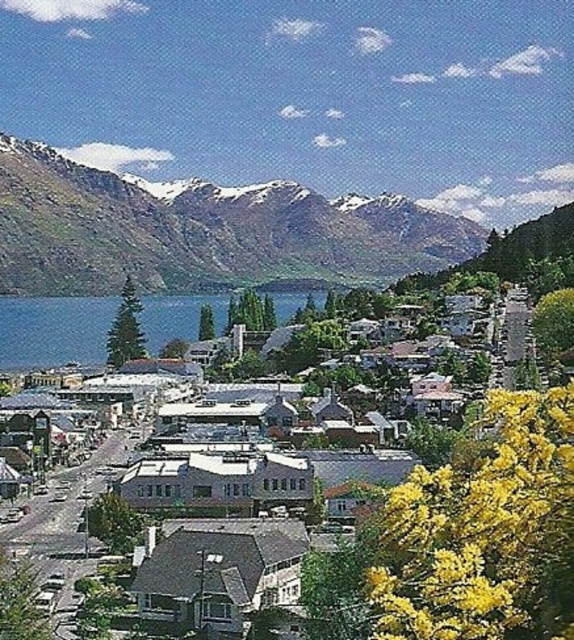
You are standing at the center of the town and want to reach the blue water at center. According to the map, there is a point marked at coordinates point [53,330]. Can you determine if this point is located in the blue water at center?

The point [53,330] corresponds to the blue water at center, so yes, the point is located in the blue water at center.

You are a photographer planning to capture the snowy rocky mountain at upper left and the blue water at center in a single frame. Considering their heights, which object should you position closer to the top of your camera frame?

The snowy rocky mountain at upper left is taller than the blue water at center, so you should position the snowy rocky mountain at upper left closer to the top of your camera frame to accommodate its greater height.